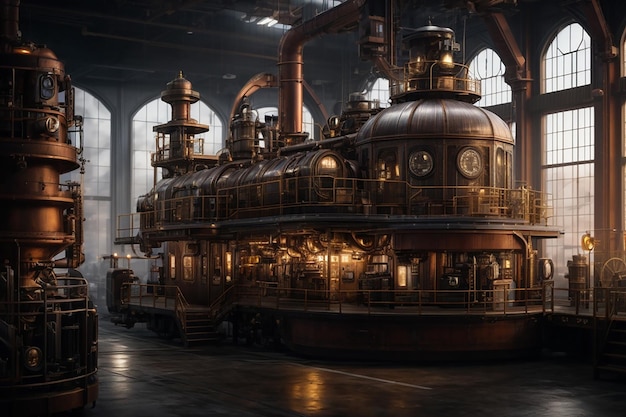
The height and width of the screenshot is (417, 626). I want to click on large windows, so click(146, 139), click(105, 125), click(571, 67), click(499, 86), click(386, 90).